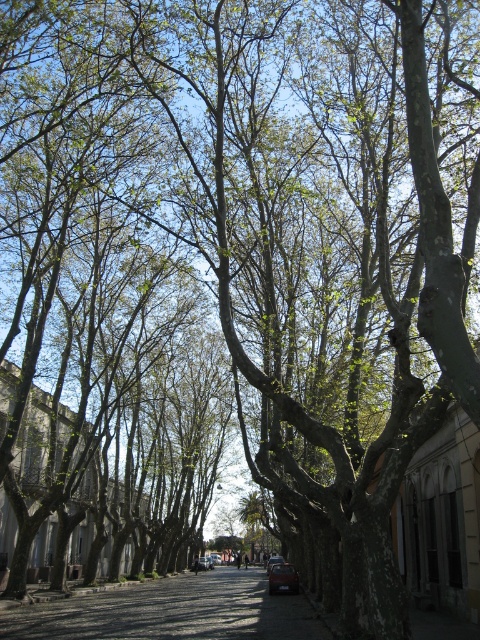
Is shiny red car at center to the right of metallic silver car at center from the viewer's perspective?

No, shiny red car at center is not to the right of metallic silver car at center.

In order to click on shiny red car at center in this screenshot , I will do `click(283, 579)`.

Looking at this image, measure the distance between matte red car at center and metallic silver car at center.

The distance of matte red car at center from metallic silver car at center is 10.95 meters.

Who is more distant from viewer, [208,566] or [273,560]?

Point [208,566]

Find the location of a particular element. matte red car at center is located at coordinates (204, 563).

Does shiny red car at center have a larger size compared to matte red car at center?

Correct, shiny red car at center is larger in size than matte red car at center.

Image resolution: width=480 pixels, height=640 pixels. What do you see at coordinates (283, 579) in the screenshot?
I see `shiny red car at center` at bounding box center [283, 579].

What do you see at coordinates (283, 579) in the screenshot? I see `shiny red car at center` at bounding box center [283, 579].

Where is `shiny red car at center`? The image size is (480, 640). shiny red car at center is located at coordinates (283, 579).